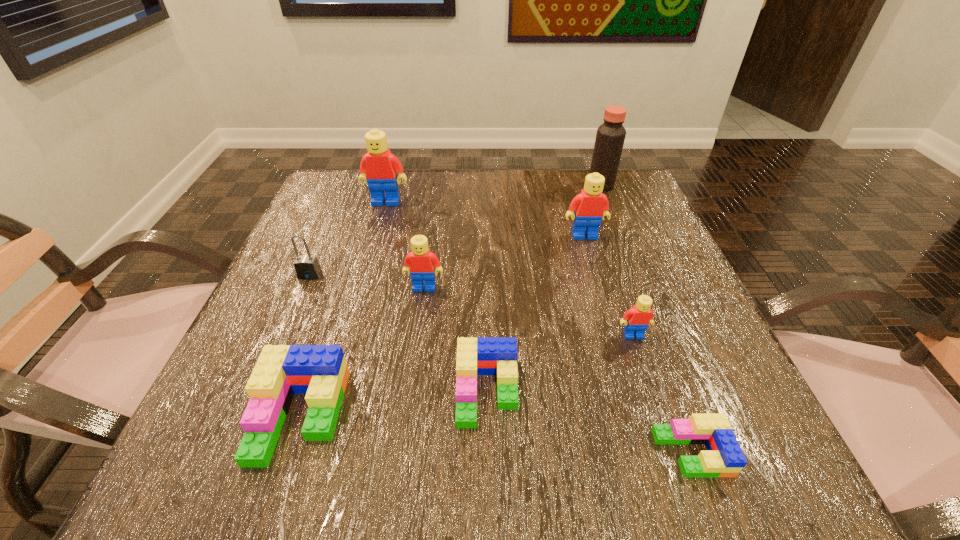
Find the location of `vacant space located 0.160m on the face of the sixth nearest Lego`. vacant space located 0.160m on the face of the sixth nearest Lego is located at coordinates (601, 293).

The width and height of the screenshot is (960, 540). Find the location of `vacant area situated on the face of the third tallest Lego`. vacant area situated on the face of the third tallest Lego is located at coordinates (403, 445).

The image size is (960, 540). In order to click on free spot located on the shackle of the gray padlock in this screenshot , I will do `click(284, 335)`.

The width and height of the screenshot is (960, 540). Identify the location of vacant area located 0.200m on the face of the fourth tallest Lego. (674, 455).

Find the location of a particular element. vacant area located 0.340m on the back of the leftmost green Lego is located at coordinates (358, 241).

The height and width of the screenshot is (540, 960). What are the coordinates of `vacant space located on the right of the sixth tallest Lego` in the screenshot? It's located at (636, 392).

You are a GUI agent. You are given a task and a screenshot of the screen. Output one action in this format:
    pyautogui.click(x=<x>, y=<y>)
    Task: Click on the vacant space located on the back of the rightmost green Lego
    Image resolution: width=960 pixels, height=540 pixels.
    Given the screenshot: What is the action you would take?
    pyautogui.click(x=654, y=351)

This screenshot has width=960, height=540. Identify the location of vinegar located at the far edge. (610, 137).

Where is `Lego located in the far edge section of the desktop`? The height and width of the screenshot is (540, 960). Lego located in the far edge section of the desktop is located at coordinates (379, 168).

Where is `padlock at the left edge`? padlock at the left edge is located at coordinates (307, 267).